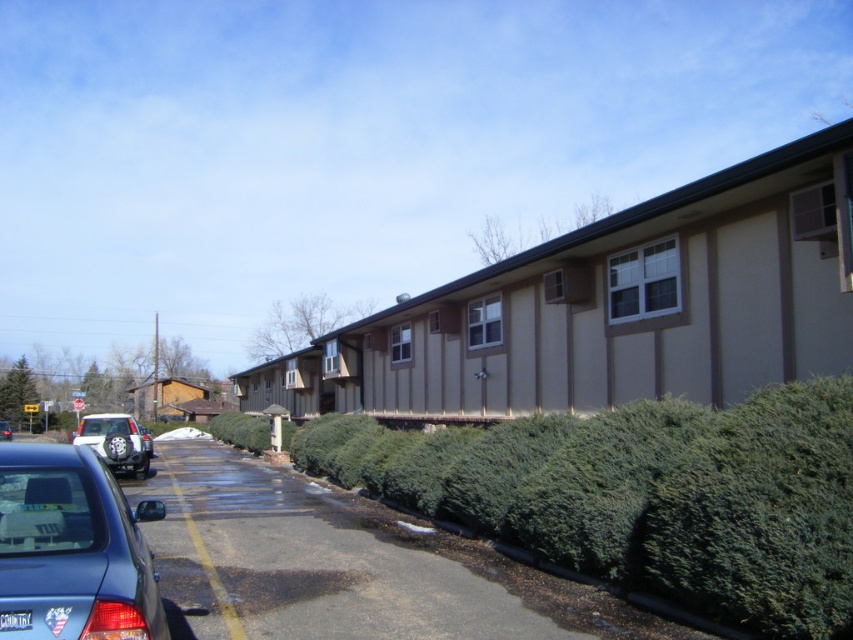
Question: Which object is positioned farthest from the green bushy hedge at center?

Choices:
 (A) silver metallic suv at left
 (B) metallic silver sedan at lower left

Answer: (B)

Question: Estimate the real-world distances between objects in this image. Which object is farther from the silver metallic suv at left?

Choices:
 (A) green bushy hedge at center
 (B) metallic silver sedan at lower left
 (C) metallic blue sedan at lower left

Answer: (C)

Question: Can you confirm if silver metallic suv at left is positioned below metallic silver sedan at lower left?

Choices:
 (A) no
 (B) yes

Answer: (A)

Question: Can you confirm if metallic blue sedan at lower left is positioned to the left of silver metallic suv at left?

Choices:
 (A) no
 (B) yes

Answer: (A)

Question: Does green bushy hedge at center appear over metallic silver sedan at lower left?

Choices:
 (A) no
 (B) yes

Answer: (B)

Question: Which object appears farthest from the camera in this image?

Choices:
 (A) metallic blue sedan at lower left
 (B) silver metallic suv at left
 (C) metallic silver sedan at lower left
 (D) green bushy hedge at center

Answer: (C)